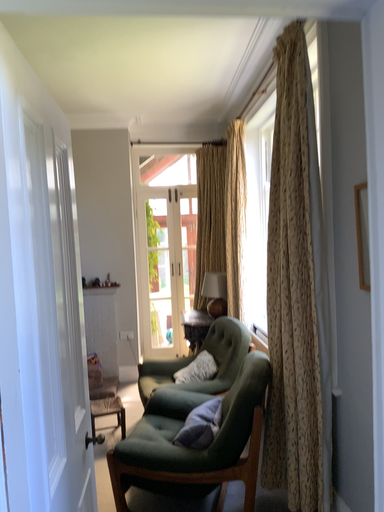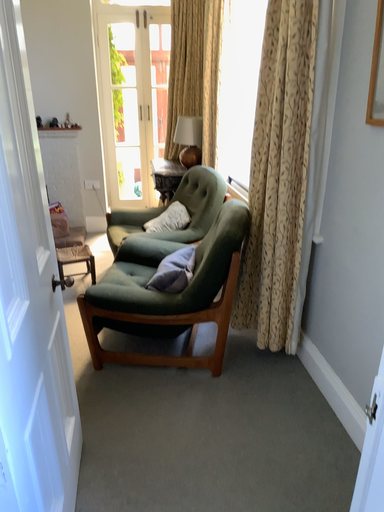
Question: How did the camera likely rotate when shooting the video?

Choices:
 (A) rotated downward
 (B) rotated upward

Answer: (A)